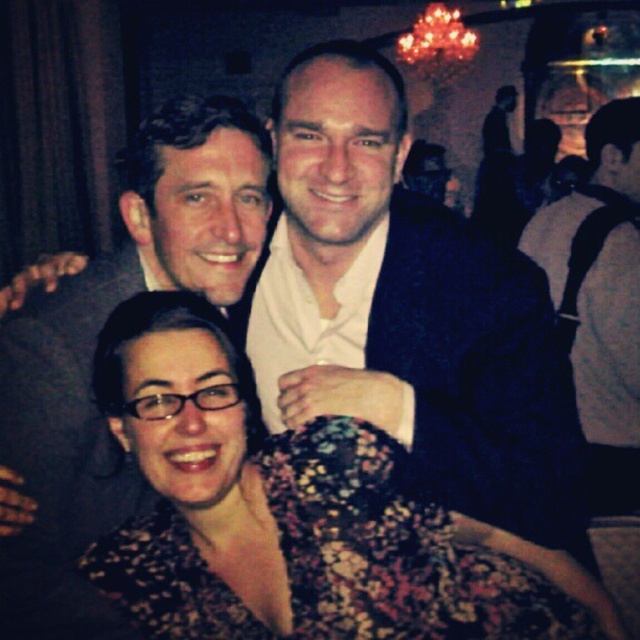
You are a photographer trying to adjust the lighting for a photo. You notice the floral dress at center and the white sweater at right. Which object is closer to the bottom of the image?

The floral dress at center is positioned under the white sweater at right, so it is closer to the bottom of the image.

You are a photographer trying to adjust the lighting for a group photo. The scene has a floral dress at center and a white sweater at right. Which object takes up more space in the photo?

The white sweater at right takes up more space in the photo than the floral dress at center because the floral dress at center occupies less space than white sweater at right.

You are standing in the scene and want to place a small gift card exactly at the point marked by coordinates point (292, 515). The gift card is 2 cm in diameter. The floral dress at center is 30 cm wide. Is there enough space to place the gift card without overlapping any other objects?

The point (292, 515) is on the floral dress at center, which is 30 cm wide. Since the gift card is only 2 cm in diameter, there should be sufficient space to place it without overlapping other objects, provided the specific area at that coordinate is unoccupied.